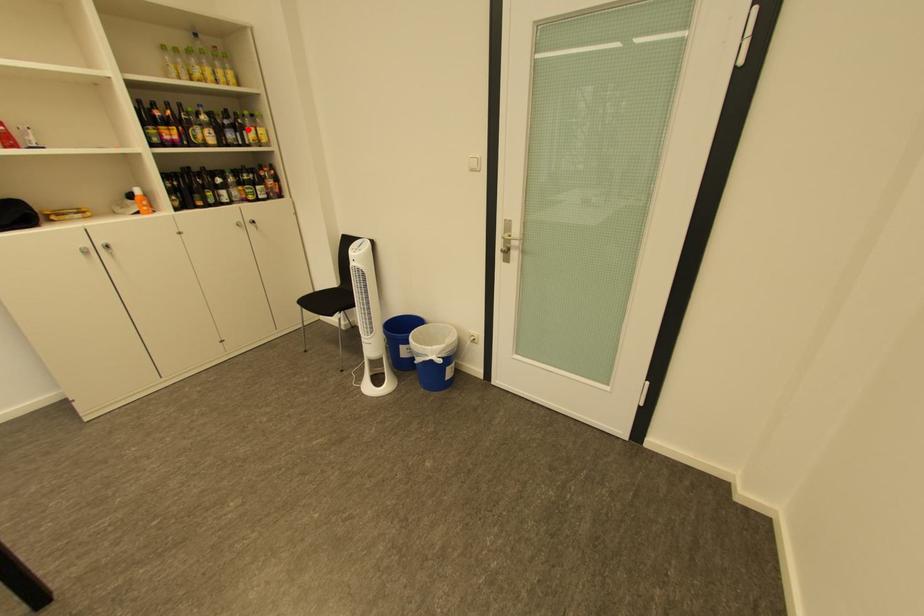
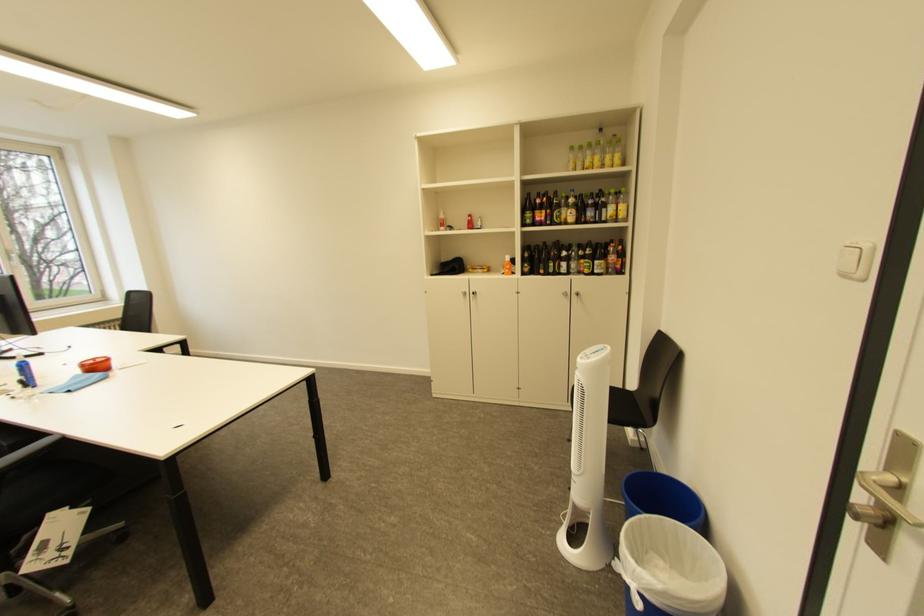
Where in the second image is the point corresponding to the highlighted location from the first image?

(610, 208)